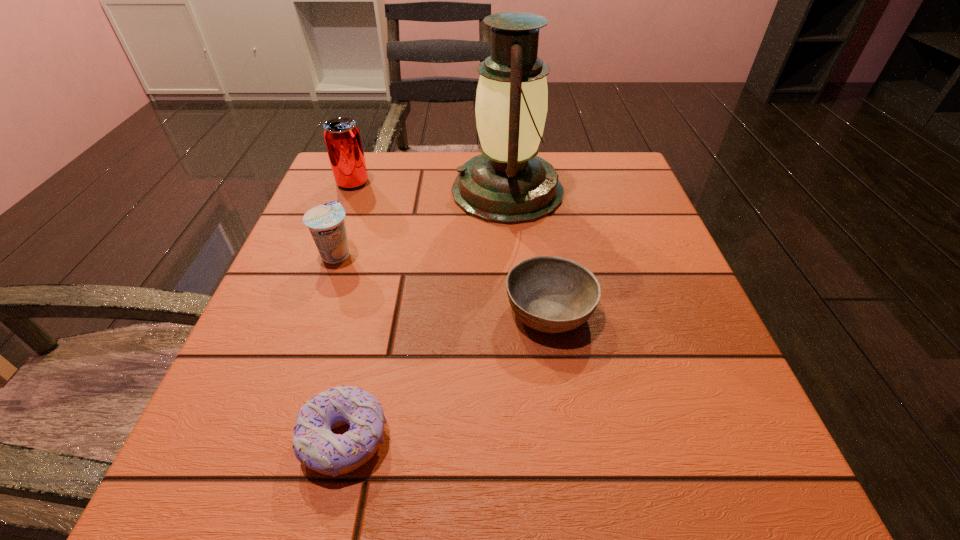
Where is `object located at the far left corner`? Image resolution: width=960 pixels, height=540 pixels. object located at the far left corner is located at coordinates (342, 137).

Locate an element on the screen. The image size is (960, 540). object located at the near left corner is located at coordinates (314, 444).

Locate an element on the screen. This screenshot has height=540, width=960. vacant region at the far edge of the desktop is located at coordinates (423, 183).

At what (x,y) coordinates should I click in order to perform the action: click on vacant space at the near edge of the desktop. Please return your answer as a coordinate pair (x, y). Looking at the image, I should click on (406, 465).

Where is `vacant space at the left edge of the desktop`? The height and width of the screenshot is (540, 960). vacant space at the left edge of the desktop is located at coordinates 317,306.

In the image, there is a desktop. At what (x,y) coordinates should I click in order to perform the action: click on vacant space at the right edge. Please return your answer as a coordinate pair (x, y). Looking at the image, I should click on (675, 406).

You are a GUI agent. You are given a task and a screenshot of the screen. Output one action in this format:
    pyautogui.click(x=<x>, y=<y>)
    Task: Click on the vacant space at the far left corner of the desktop
    The image size is (960, 540).
    Given the screenshot: What is the action you would take?
    pyautogui.click(x=382, y=174)

In the image, there is a desktop. At what (x,y) coordinates should I click in order to perform the action: click on vacant area at the far right corner. Please return your answer as a coordinate pair (x, y). This screenshot has height=540, width=960. Looking at the image, I should click on (598, 177).

Locate an element on the screen. vacant area at the near right corner of the desktop is located at coordinates (744, 464).

Locate an element on the screen. The image size is (960, 540). free space between the yogurt and the lantern is located at coordinates (421, 222).